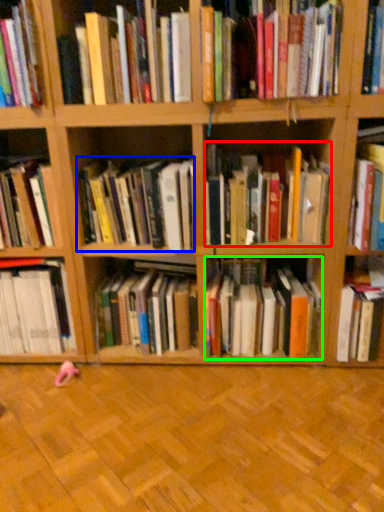
Question: Estimate the real-world distances between objects in this image. Which object is farther from book (highlighted by a red box), book (highlighted by a blue box) or book (highlighted by a green box)?

Choices:
 (A) book
 (B) book

Answer: (B)